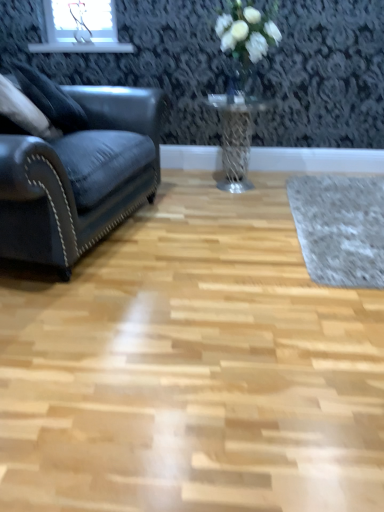
Question: Considering the relative positions of gray woolen mat at right and clear glass vase at upper center in the image provided, is gray woolen mat at right to the left of clear glass vase at upper center from the viewer's perspective?

Choices:
 (A) no
 (B) yes

Answer: (A)

Question: Is the position of gray woolen mat at right less distant than that of clear glass vase at upper center?

Choices:
 (A) no
 (B) yes

Answer: (B)

Question: From the image's perspective, is gray woolen mat at right located beneath clear glass vase at upper center?

Choices:
 (A) no
 (B) yes

Answer: (B)

Question: Can you confirm if gray woolen mat at right is bigger than clear glass vase at upper center?

Choices:
 (A) yes
 (B) no

Answer: (A)

Question: Considering the relative sizes of gray woolen mat at right and clear glass vase at upper center in the image provided, is gray woolen mat at right shorter than clear glass vase at upper center?

Choices:
 (A) yes
 (B) no

Answer: (A)

Question: Considering the positions of clear glass vase at upper center and velvet dark blue couch at left in the image, is clear glass vase at upper center wider or thinner than velvet dark blue couch at left?

Choices:
 (A) thin
 (B) wide

Answer: (A)

Question: From a real-world perspective, is clear glass vase at upper center above or below velvet dark blue couch at left?

Choices:
 (A) below
 (B) above

Answer: (B)

Question: Considering the positions of point (228, 99) and point (29, 232), is point (228, 99) closer or farther from the camera than point (29, 232)?

Choices:
 (A) closer
 (B) farther

Answer: (B)

Question: Based on their sizes in the image, would you say clear glass vase at upper center is bigger or smaller than velvet dark blue couch at left?

Choices:
 (A) big
 (B) small

Answer: (B)

Question: Does point (243, 178) appear closer or farther from the camera than point (223, 23)?

Choices:
 (A) closer
 (B) farther

Answer: (B)

Question: Considering the positions of metallic mesh table at center and white matte vase at upper center in the image, is metallic mesh table at center taller or shorter than white matte vase at upper center?

Choices:
 (A) short
 (B) tall

Answer: (B)

Question: Considering the relative positions of metallic mesh table at center and white matte vase at upper center in the image provided, is metallic mesh table at center to the left or to the right of white matte vase at upper center?

Choices:
 (A) right
 (B) left

Answer: (B)

Question: Is metallic mesh table at center bigger or smaller than white matte vase at upper center?

Choices:
 (A) small
 (B) big

Answer: (B)

Question: Considering the positions of clear glass vase at upper center and white matte vase at upper center in the image, is clear glass vase at upper center taller or shorter than white matte vase at upper center?

Choices:
 (A) short
 (B) tall

Answer: (A)

Question: From the image's perspective, relative to white matte vase at upper center, is clear glass vase at upper center above or below?

Choices:
 (A) above
 (B) below

Answer: (B)